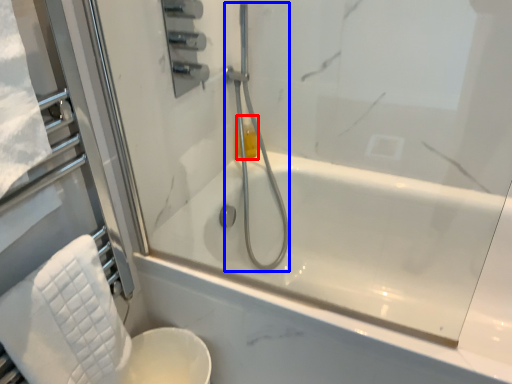
Question: Which of the following is the closest to the observer, toiletry (highlighted by a red box) or shower (highlighted by a blue box)?

Choices:
 (A) toiletry
 (B) shower

Answer: (B)